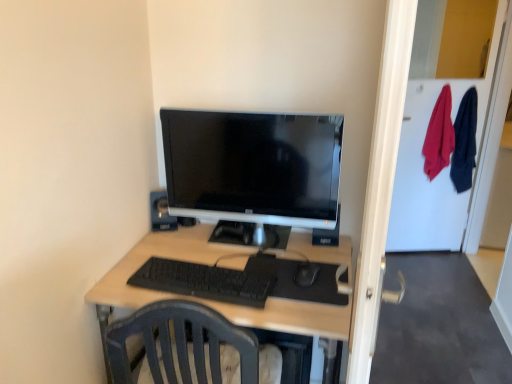
Find the location of `vacant space to the right of black plastic speaker at upper center`. vacant space to the right of black plastic speaker at upper center is located at coordinates (197, 241).